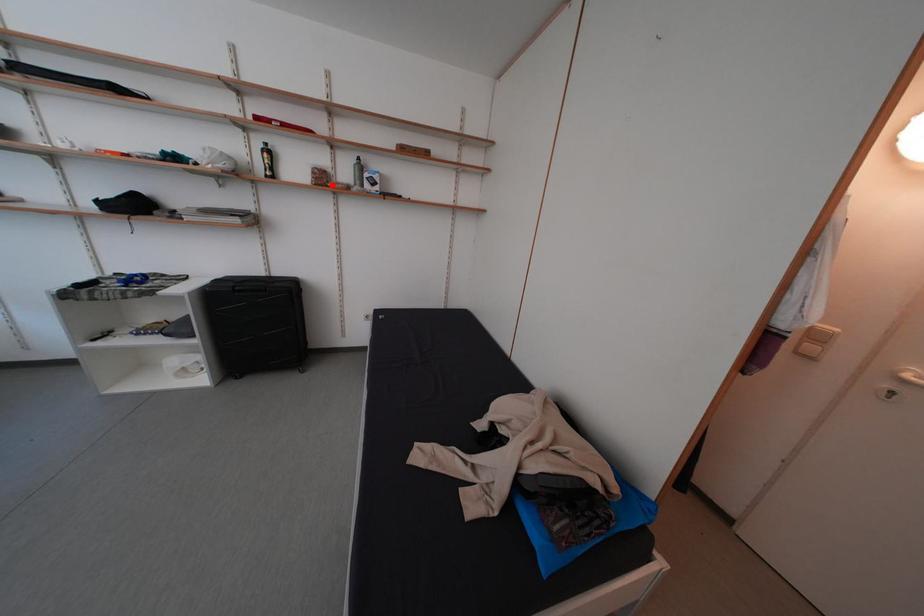
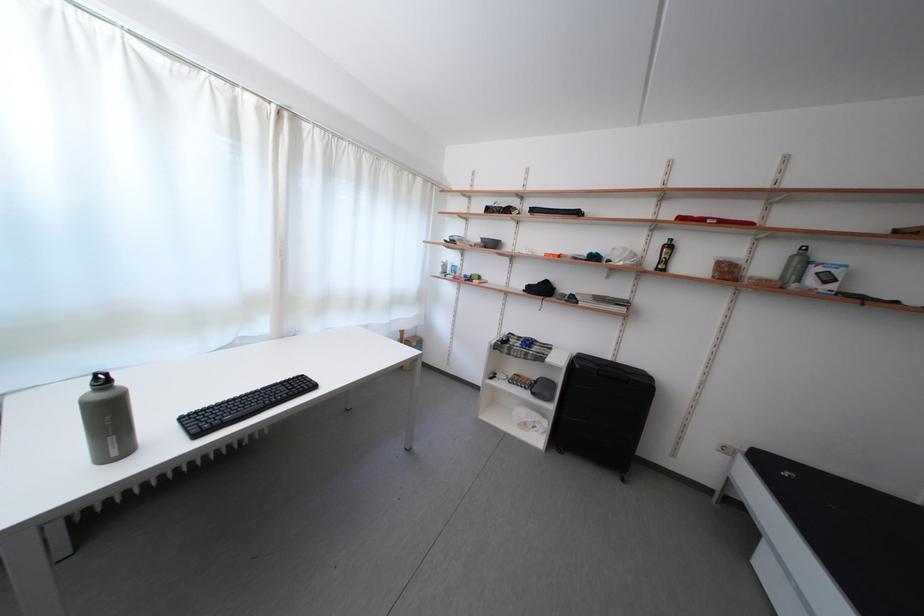
The point at the highlighted location is marked in the first image. Where is the corresponding point in the second image?

(736, 278)